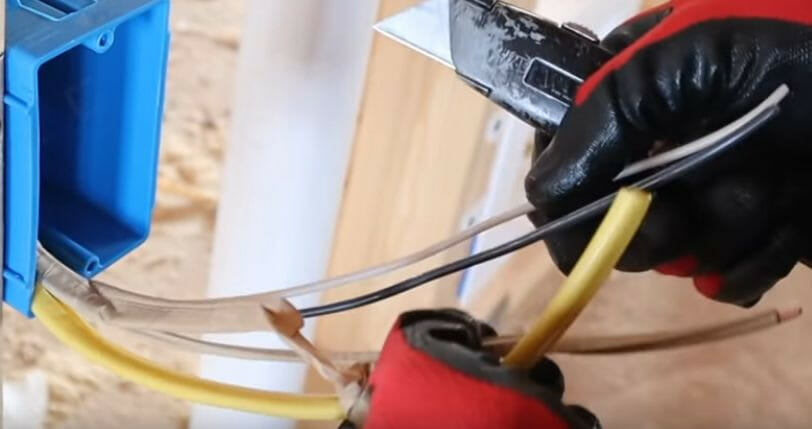
What are the coordinates of `yellow cable` in the screenshot? It's located at (547, 319).